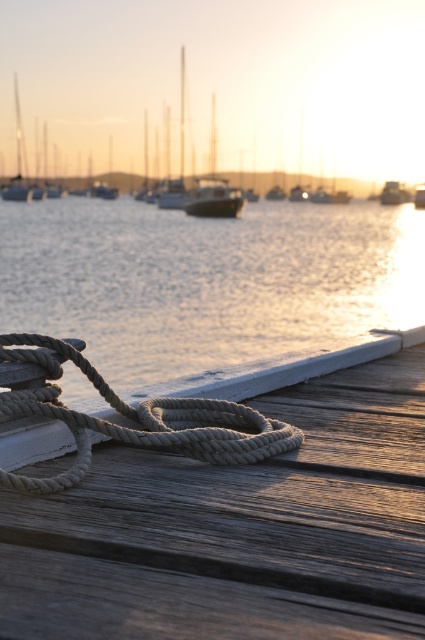
You are standing on the wooden dock and see two points marked in the scene. The first point is at coordinates point (5,358) and the second point is at point (195,196). Which point is closer to you as you face the water?

Point (5,358) is in front of point (195,196), so it is closer to you as you face the water.